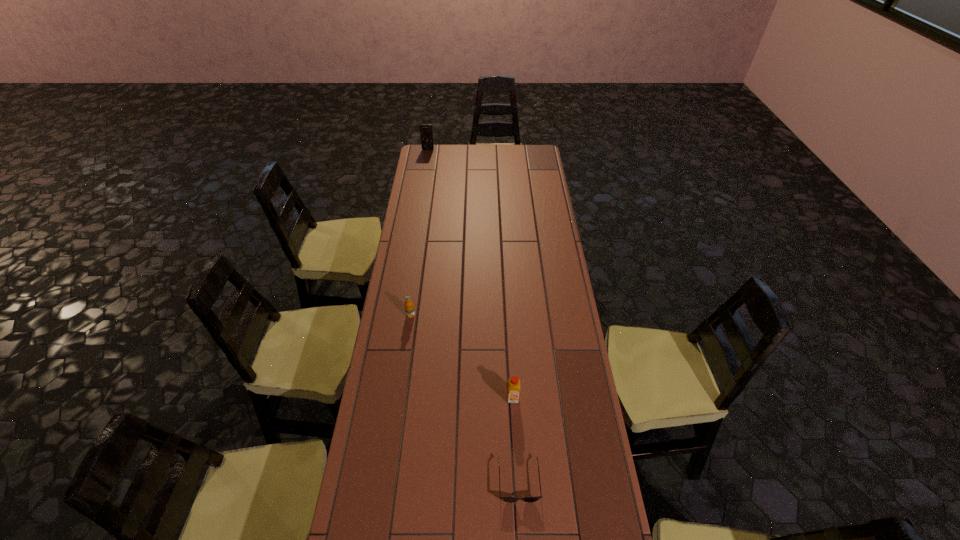
Identify the location of empty space between the right orange juice and the third nearest object. The image size is (960, 540). (462, 356).

Find the location of a particular element. The width and height of the screenshot is (960, 540). free space between the farther orange juice and the nearer orange juice is located at coordinates (462, 356).

Find the location of a particular element. free space between the cellular telephone and the shorter orange juice is located at coordinates (420, 232).

You are a GUI agent. You are given a task and a screenshot of the screen. Output one action in this format:
    pyautogui.click(x=<x>, y=<y>)
    Task: Click on the unoccupied area between the cellular telephone and the third tallest object
    
    Given the screenshot: What is the action you would take?
    pyautogui.click(x=420, y=232)

Where is `vacant area that lies between the nearer orange juice and the shortest object`? The height and width of the screenshot is (540, 960). vacant area that lies between the nearer orange juice and the shortest object is located at coordinates (516, 439).

Where is `free point between the sunglasses and the farther orange juice`? This screenshot has height=540, width=960. free point between the sunglasses and the farther orange juice is located at coordinates (465, 398).

Find the location of a particular element. The height and width of the screenshot is (540, 960). vacant space that is in between the shorter orange juice and the sunglasses is located at coordinates (465, 398).

Locate an element on the screen. This screenshot has width=960, height=540. vacant point located between the nearer orange juice and the cellular telephone is located at coordinates (470, 274).

The height and width of the screenshot is (540, 960). In order to click on vacant area that lies between the second shortest object and the shortest object in this screenshot , I will do `click(465, 398)`.

This screenshot has height=540, width=960. Find the location of `blank region between the farthest object and the farther orange juice`. blank region between the farthest object and the farther orange juice is located at coordinates (420, 232).